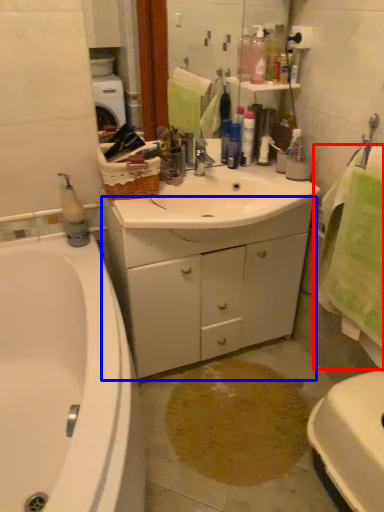
Question: Which object appears farthest to the camera in this image, bath towel (highlighted by a red box) or cabinetry (highlighted by a blue box)?

Choices:
 (A) bath towel
 (B) cabinetry

Answer: (B)